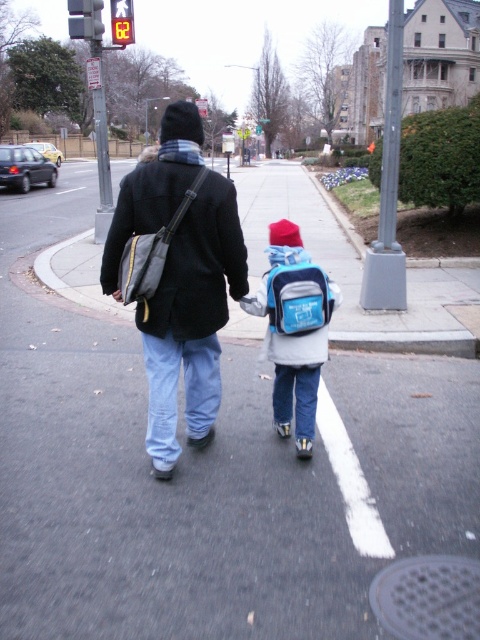
Question: Among these objects, which one is farthest from the camera?

Choices:
 (A) dark matte jacket at upper left
 (B) red plastic traffic light at upper left
 (C) blue fabric backpack at center

Answer: (B)

Question: In this image, where is blue fabric backpack at center located relative to red plastic traffic light at upper left?

Choices:
 (A) right
 (B) left

Answer: (A)

Question: Does blue fabric backpack at center have a greater width compared to red plastic traffic light at upper left?

Choices:
 (A) yes
 (B) no

Answer: (A)

Question: In this image, where is dark matte jacket at upper left located relative to red plastic traffic light at upper left?

Choices:
 (A) above
 (B) below

Answer: (B)

Question: Which object is closer to the camera taking this photo?

Choices:
 (A) blue fabric backpack at center
 (B) red plastic traffic light at upper left
 (C) dark matte jacket at upper left

Answer: (C)

Question: Which point appears closest to the camera in this image?

Choices:
 (A) (116, 28)
 (B) (142, 221)

Answer: (B)